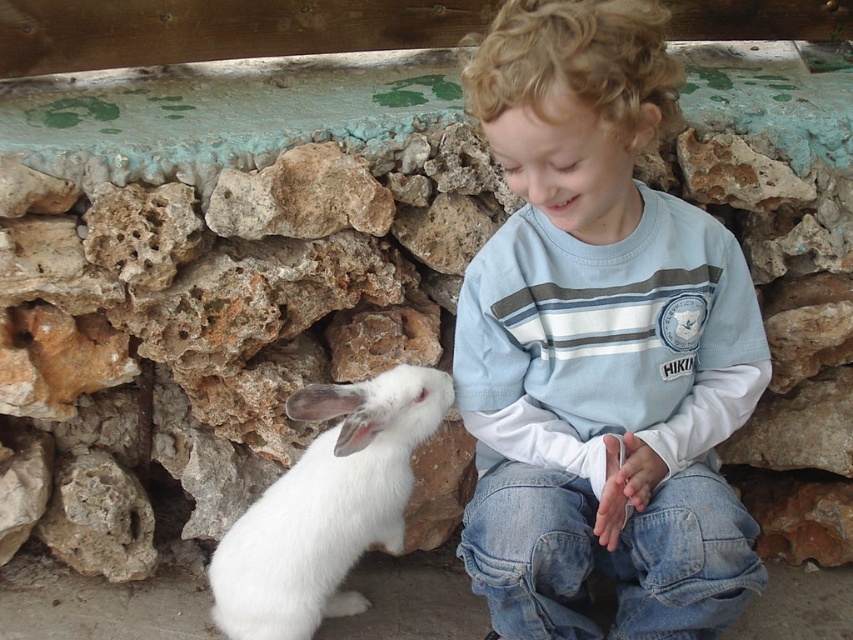
Between light blue cotton shirt at center and white fluffy rabbit at left, which one is positioned higher?

light blue cotton shirt at center is above.

In the scene shown: Which of these two, light blue cotton shirt at center or white fluffy rabbit at left, stands shorter?

With less height is white fluffy rabbit at left.

At what (x,y) coordinates should I click in order to perform the action: click on light blue cotton shirt at center. Please return your answer as a coordinate pair (x, y). This screenshot has width=853, height=640. Looking at the image, I should click on (599, 342).